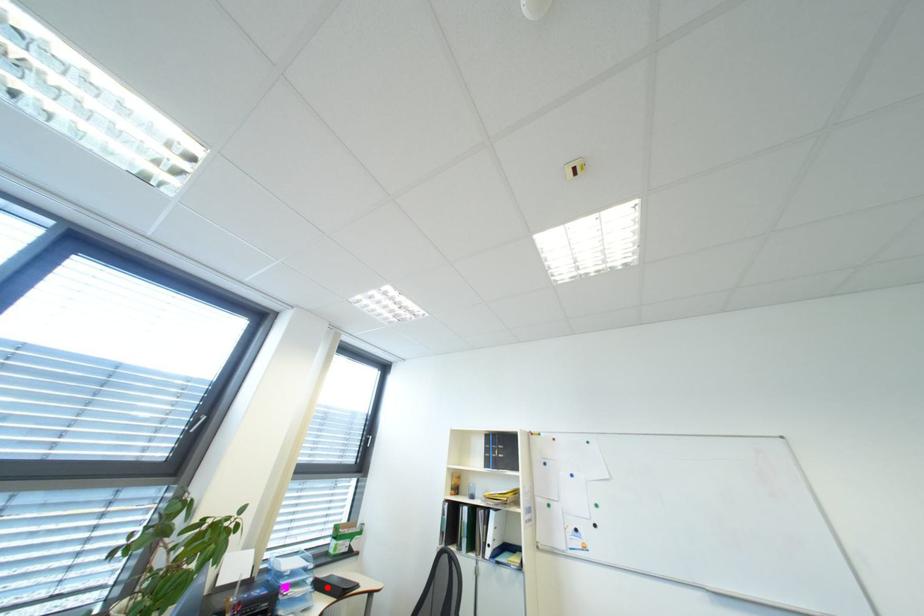
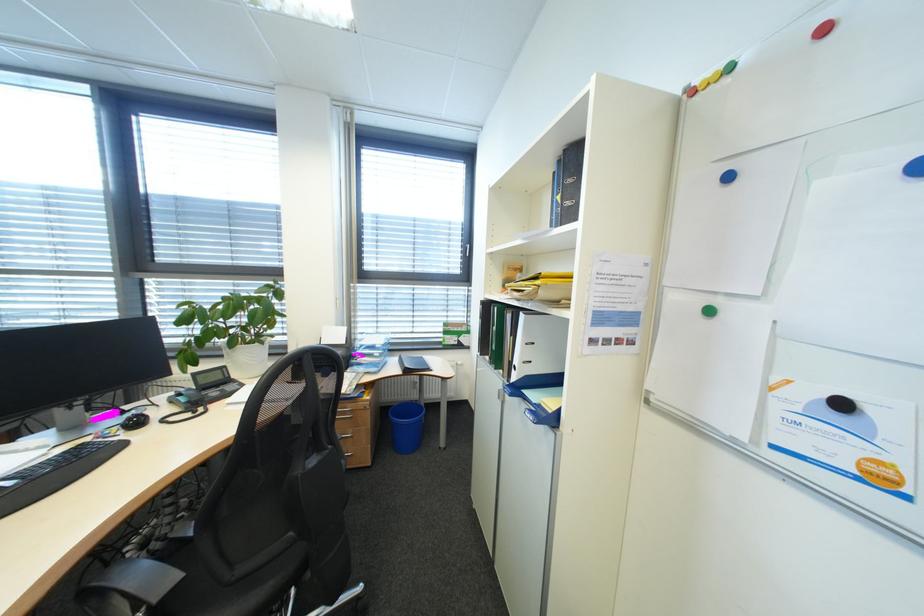
Question: A red point is marked in image1. In image2, is the corresponding 3D point closer to the camera or farther? Reply with the corresponding letter.

Choices:
 (A) The corresponding 3D point is closer.
 (B) The corresponding 3D point is farther.

Answer: (A)